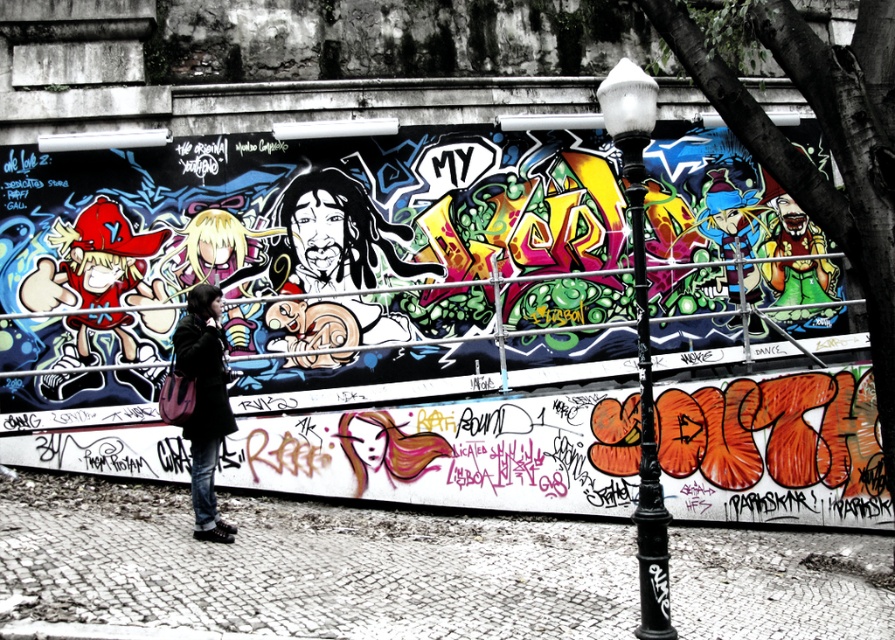
You are a painter standing at the bottom of the wall with the graffiti. You need to reach the central part of the mural to touch up the bold, stylized text. Is the metal scaffolding at center positioned in a way that allows you to access that area?

The metal scaffolding at center is located at point (419,339), which is centrally positioned on the wall. This placement should allow the painter to access the central part of the mural where the bold, stylized text is located for touchups.

You are a painter standing near the metal scaffolding at center and the black metal lamp post at center. You need to choose the smaller one to place your ladder. Which object should you choose?

The metal scaffolding at center has a smaller size compared to the black metal lamp post at center, so you should choose the metal scaffolding at center to place your ladder.

You are standing in front of the graffiti wall and want to touch both points on the wall. Which point, point (654, 522) or point (224, 428), will you reach first?

Point (654, 522) is closer to the camera than point (224, 428), so you will reach point (654, 522) first.